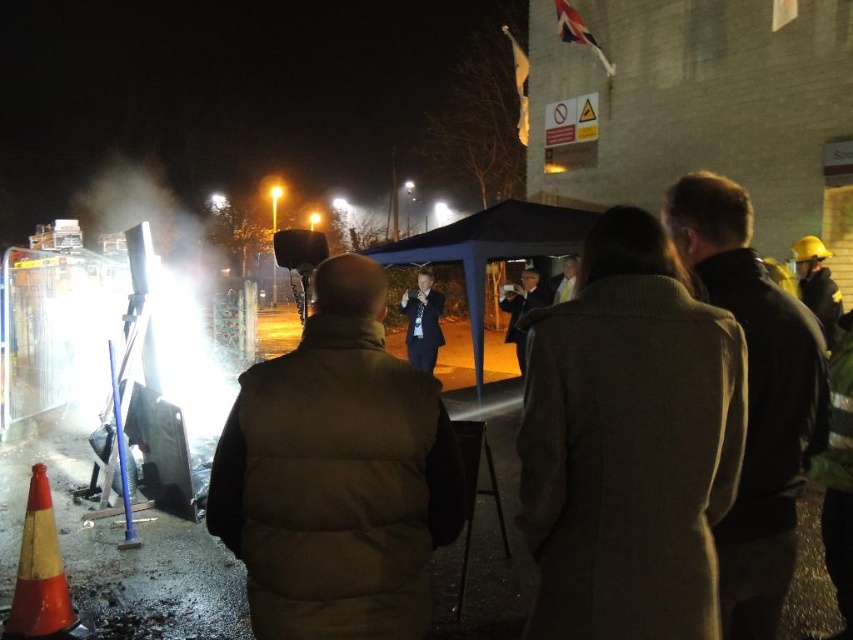
Question: Where is brown puffer vest at center located in relation to orange reflective cone at lower left in the image?

Choices:
 (A) left
 (B) right

Answer: (B)

Question: Is brown puffer vest at center below orange reflective cone at lower left?

Choices:
 (A) yes
 (B) no

Answer: (B)

Question: Among these points, which one is farthest from the camera?

Choices:
 (A) tap(418, 384)
 (B) tap(45, 589)

Answer: (B)

Question: Which of the following is the closest to the observer?

Choices:
 (A) (45, 557)
 (B) (245, 541)

Answer: (B)

Question: Does brown puffer vest at center appear on the right side of orange reflective cone at lower left?

Choices:
 (A) yes
 (B) no

Answer: (A)